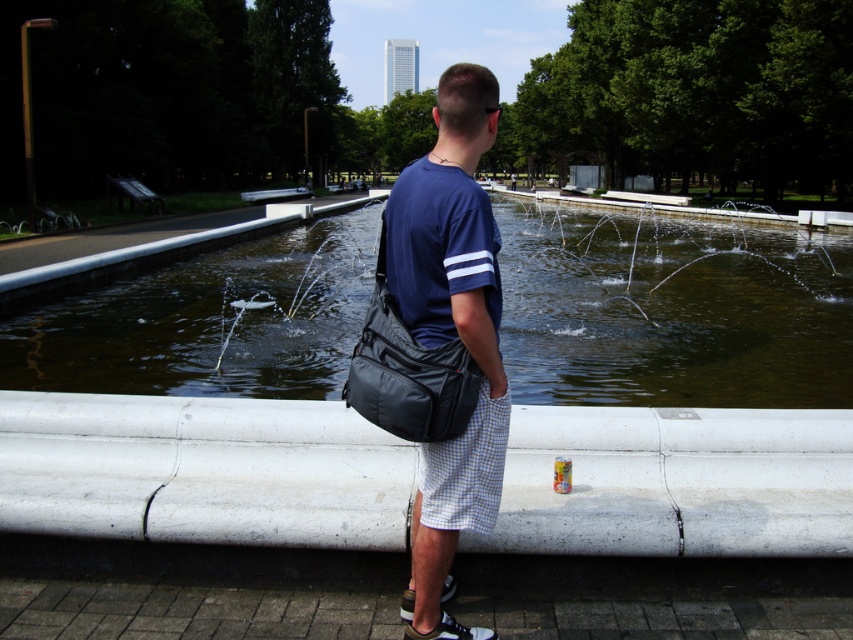
Is matte black bag at center shorter than black fabric bag at center?

No.

Does matte black bag at center have a smaller size compared to black fabric bag at center?

Incorrect, matte black bag at center is not smaller in size than black fabric bag at center.

This screenshot has height=640, width=853. What are the coordinates of `matte black bag at center` in the screenshot? It's located at pyautogui.click(x=451, y=333).

Identify the location of matte black bag at center. (451, 333).

Who is more forward, (x=180, y=360) or (x=450, y=369)?

Point (x=450, y=369) is more forward.

At what (x,y) coordinates should I click in order to perform the action: click on clear water at center. Please return your answer as a coordinate pair (x, y). Looking at the image, I should click on (672, 310).

Locate an element on the screen. clear water at center is located at coordinates (672, 310).

Is clear water at center smaller than matte black bag at center?

Incorrect, clear water at center is not smaller in size than matte black bag at center.

Can you confirm if clear water at center is wider than matte black bag at center?

Correct, the width of clear water at center exceeds that of matte black bag at center.

Locate an element on the screen. Image resolution: width=853 pixels, height=640 pixels. clear water at center is located at coordinates (672, 310).

At what (x,y) coordinates should I click in order to perform the action: click on clear water at center. Please return your answer as a coordinate pair (x, y). Looking at the image, I should click on (672, 310).